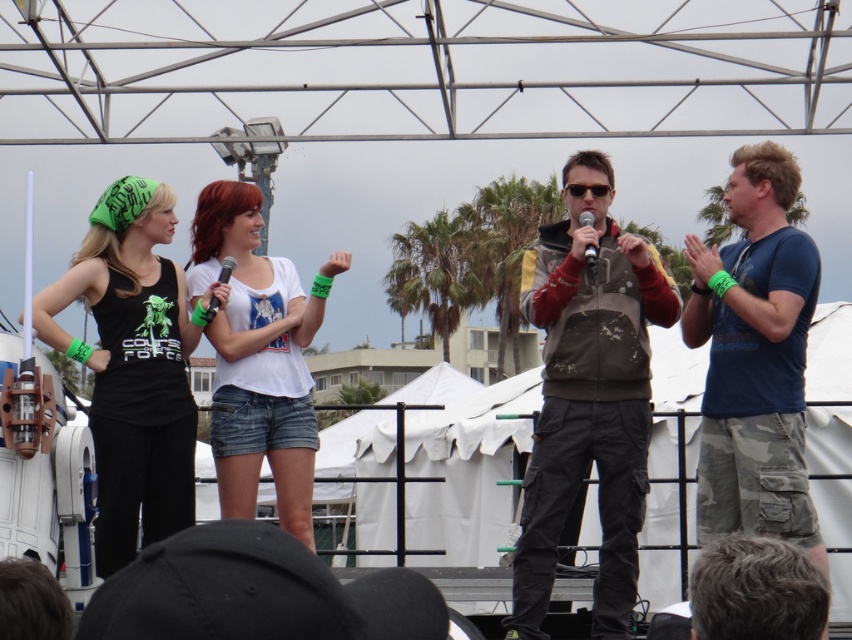
Where is the white cotton shirt at center located in the image?

The white cotton shirt at center is located at point 0.561 on the x axis and 0.304 on the y axis.

You are a photographer at the event and need to focus your camera on the white cotton shirt at center and the black plastic microphone at center. Which object should you adjust your focus to first if you want to capture both in one shot?

The white cotton shirt at center has a greater height compared to the black plastic microphone at center, so you should focus on the white cotton shirt at center first since it is taller and likely more prominent in the frame.

You are a photographer taking a picture of the stage. The camera is focused on the black plastic microphone at center. Will the distressed brown jacket at center also be in focus?

The distressed brown jacket at center is below the black plastic microphone at center, so if the camera is focused on the microphone, the jacket might be slightly out of focus depending on the depth of field. However, since both are at the same center position vertically, they might still be within the focus range.